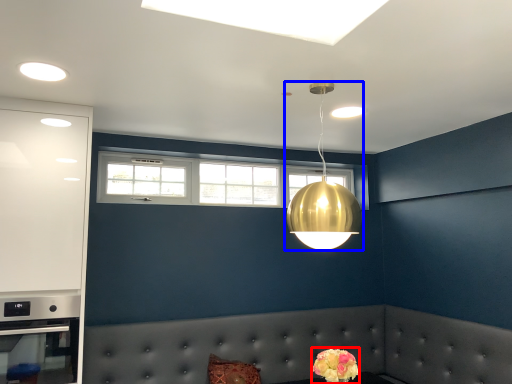
Question: Among these objects, which one is farthest to the camera, flower (highlighted by a red box) or lamp (highlighted by a blue box)?

Choices:
 (A) flower
 (B) lamp

Answer: (A)